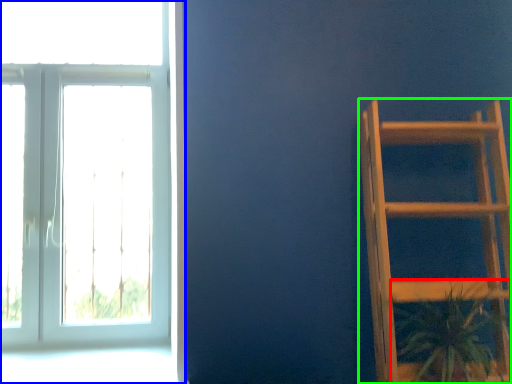
Question: Which object is positioned closest to houseplant (highlighted by a red box)? Select from window (highlighted by a blue box) and furniture (highlighted by a green box).

Choices:
 (A) window
 (B) furniture

Answer: (B)